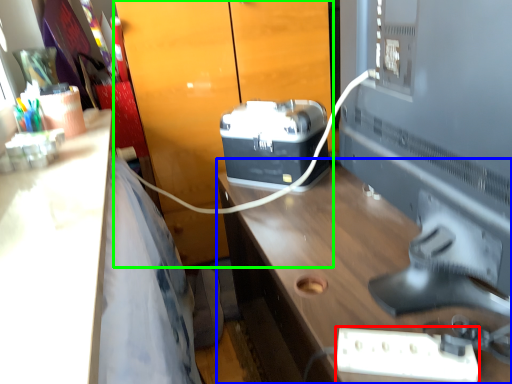
Question: Based on their relative distances, which object is nearer to extension cord (highlighted by a red box)? Choose from desk (highlighted by a blue box) and dresser (highlighted by a green box).

Choices:
 (A) desk
 (B) dresser

Answer: (A)